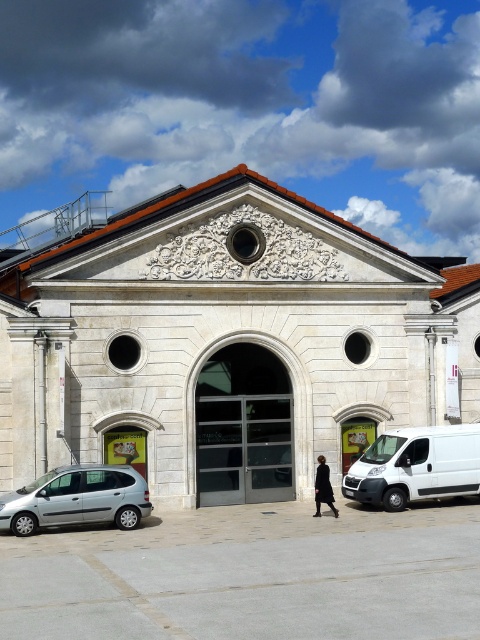
Is white stone church at center behind black matte coat at center?

That is True.

Does white stone church at center have a larger size compared to black matte coat at center?

Correct, white stone church at center is larger in size than black matte coat at center.

Is point (323, 397) positioned before point (330, 500)?

No, (323, 397) is behind (330, 500).

At what (x,y) coordinates should I click in order to perform the action: click on white stone church at center. Please return your answer as a coordinate pair (x, y). The height and width of the screenshot is (640, 480). Looking at the image, I should click on (228, 342).

Based on the photo, who is more forward, (x=75, y=492) or (x=328, y=497)?

Point (x=75, y=492) is in front.

Describe the element at coordinates (76, 499) in the screenshot. The width and height of the screenshot is (480, 640). I see `silver metallic minivan at lower left` at that location.

Locate an element on the screen. This screenshot has width=480, height=640. silver metallic minivan at lower left is located at coordinates (76, 499).

Image resolution: width=480 pixels, height=640 pixels. Identify the location of silver metallic minivan at lower left. (76, 499).

Can you confirm if white stone church at center is wider than silver metallic minivan at lower left?

Yes, white stone church at center is wider than silver metallic minivan at lower left.

Does white stone church at center appear over silver metallic minivan at lower left?

Indeed, white stone church at center is positioned over silver metallic minivan at lower left.

The height and width of the screenshot is (640, 480). In order to click on white stone church at center in this screenshot , I will do `click(228, 342)`.